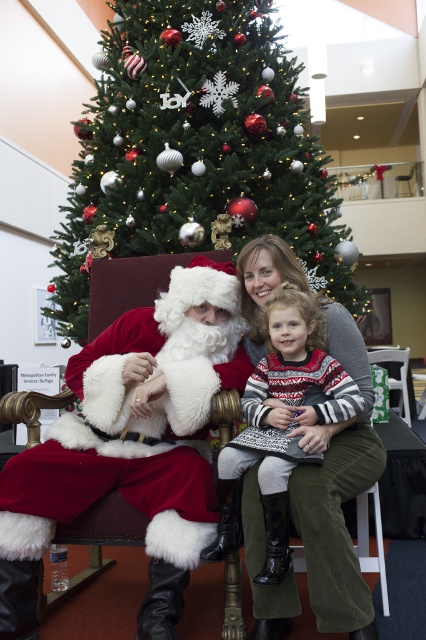
Is green textured christmas tree at center shorter than fuzzy white santa at center?

No.

Which is behind, point (120, 156) or point (218, 291)?

Positioned behind is point (120, 156).

Image resolution: width=426 pixels, height=640 pixels. In order to click on green textured christmas tree at center in this screenshot , I will do `click(196, 147)`.

Measure the distance between point (126, 381) and camera.

They are 5.82 feet apart.

Is fuzzy white santa at center thinner than knitted sweater at center?

No.

Identify the location of fuzzy white santa at center. This screenshot has width=426, height=640. (132, 444).

The height and width of the screenshot is (640, 426). In order to click on green textured christmas tree at center in this screenshot , I will do click(196, 147).